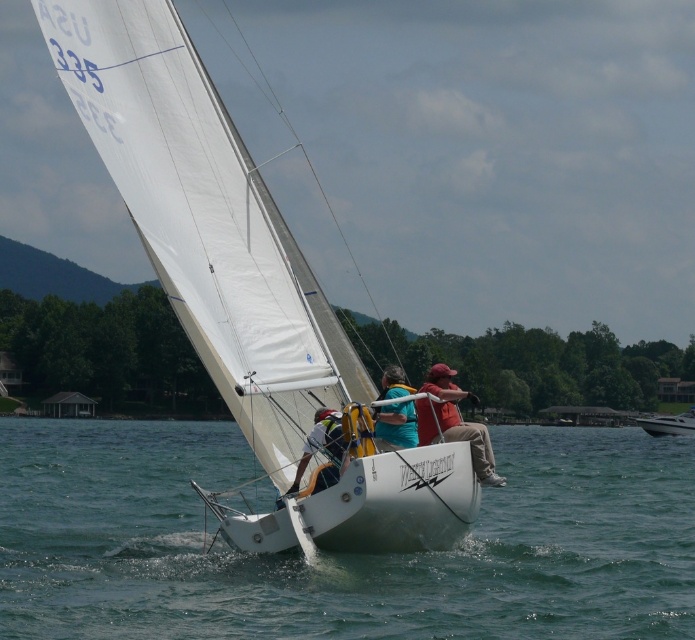
You are an observer standing on the shore looking at the clear blue water at center and the white matte sailboat at center. Which object appears taller from your perspective?

The white matte sailboat at center appears taller than the clear blue water at center from your perspective.

You are standing on the deck of the sailboat named WIND LIGHTNING and need to reach a point on the deck. The two points you are considering are point (x=208, y=218) and point (x=420, y=406). Which point is closer to you?

Point (x=208, y=218) is closer to the viewer than point (x=420, y=406), so you should choose that one.

You are a photographer trying to capture the white matte sailboat at center and the red fabric cap at center in a single shot. Given that your camera can only focus on objects wider than 10 cm, will both objects fit within the frame if the sailboat is wider than the cap?

The white matte sailboat at center is wider than the red fabric cap at center. Since the sailboat is wider than the cap and the camera requires objects wider than 10 cm, both objects will fit within the frame as long as the sailboat meets the minimum width requirement.